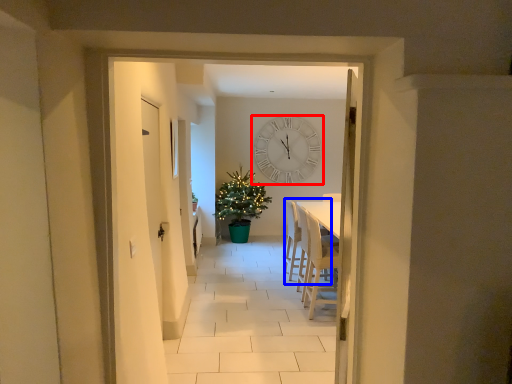
Question: Which object appears closest to the camera in this image, wall clock (highlighted by a red box) or armchair (highlighted by a blue box)?

Choices:
 (A) wall clock
 (B) armchair

Answer: (B)